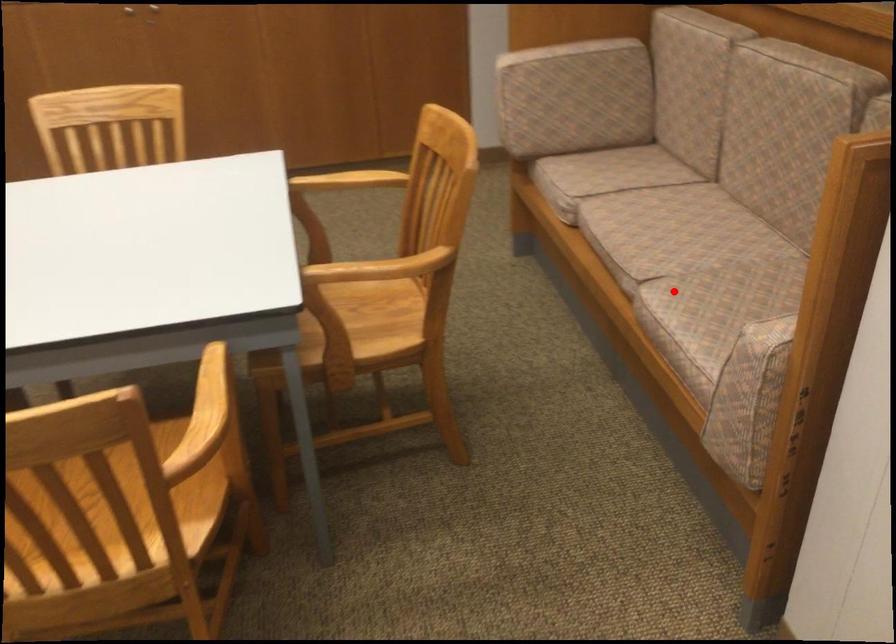
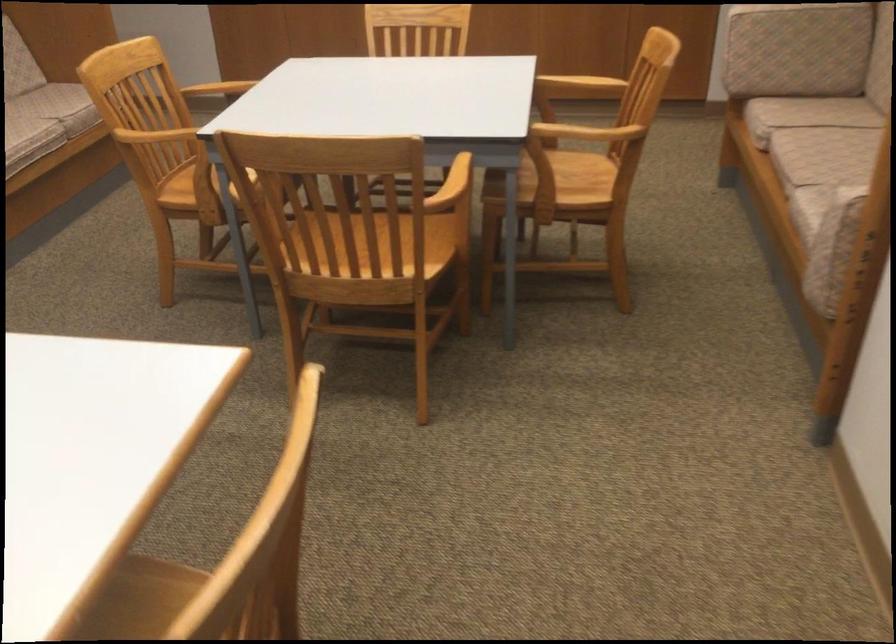
Find the pixel in the second image that matches the highlighted location in the first image.

(822, 190)